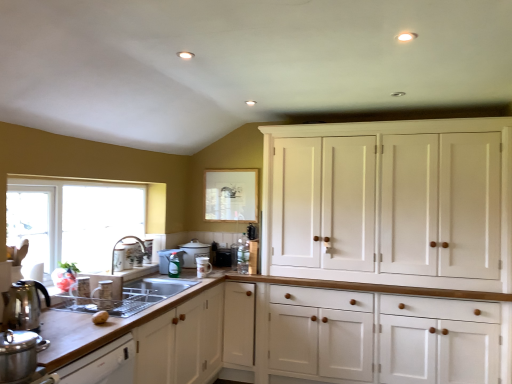
Question: Considering the relative sizes of brown matte potato at lower left and matte white cup at sink, which is counted as the second appliance, starting from the front, in the image provided, is brown matte potato at lower left taller than matte white cup at sink, which is counted as the second appliance, starting from the front,?

Choices:
 (A) no
 (B) yes

Answer: (A)

Question: Is brown matte potato at lower left facing away from matte white cup at sink, which is the 5th appliance in back-to-front order?

Choices:
 (A) no
 (B) yes

Answer: (A)

Question: Considering the relative sizes of brown matte potato at lower left and matte white cup at sink, which is the 5th appliance in back-to-front order, in the image provided, is brown matte potato at lower left smaller than matte white cup at sink, which is the 5th appliance in back-to-front order,?

Choices:
 (A) yes
 (B) no

Answer: (A)

Question: Is brown matte potato at lower left further to the viewer compared to matte white cup at sink, which is the 5th appliance in back-to-front order?

Choices:
 (A) no
 (B) yes

Answer: (A)

Question: Is brown matte potato at lower left not near matte white cup at sink, which is counted as the second appliance, starting from the front?

Choices:
 (A) no
 (B) yes

Answer: (A)

Question: From a real-world perspective, is black matte toaster at center, which ranks as the 1th appliance in back-to-front order, positioned above or below translucent plastic spray bottle at center, marked as the 3th appliance in a back-to-front arrangement?

Choices:
 (A) above
 (B) below

Answer: (B)

Question: From the image's perspective, relative to translucent plastic spray bottle at center, which is counted as the fourth appliance, starting from the front, is black matte toaster at center, which ranks as the sixth appliance in front-to-back order, above or below?

Choices:
 (A) below
 (B) above

Answer: (A)

Question: Would you say black matte toaster at center, which ranks as the 1th appliance in back-to-front order, is to the left or to the right of translucent plastic spray bottle at center, which is counted as the fourth appliance, starting from the front, in the picture?

Choices:
 (A) left
 (B) right

Answer: (B)

Question: Based on their sizes in the image, would you say black matte toaster at center, which ranks as the sixth appliance in front-to-back order, is bigger or smaller than translucent plastic spray bottle at center, which is counted as the fourth appliance, starting from the front?

Choices:
 (A) small
 (B) big

Answer: (A)

Question: Considering the positions of white ceramic mug at center, which is the third appliance from front to back, and shiny metallic kettle at left in the image, is white ceramic mug at center, which is the third appliance from front to back, wider or thinner than shiny metallic kettle at left?

Choices:
 (A) thin
 (B) wide

Answer: (A)

Question: Relative to shiny metallic kettle at left, is white ceramic mug at center, acting as the 4th appliance starting from the back, in front or behind?

Choices:
 (A) front
 (B) behind

Answer: (B)

Question: Considering the relative positions of white ceramic mug at center, acting as the 4th appliance starting from the back, and shiny metallic kettle at left in the image provided, is white ceramic mug at center, acting as the 4th appliance starting from the back, to the left or to the right of shiny metallic kettle at left?

Choices:
 (A) left
 (B) right

Answer: (B)

Question: From the image's perspective, is white ceramic mug at center, acting as the 4th appliance starting from the back, positioned above or below shiny metallic kettle at left?

Choices:
 (A) above
 (B) below

Answer: (B)

Question: From a real-world perspective, is white ceramic mug at center, which is the third appliance from front to back, above or below satin silver sink at lower left?

Choices:
 (A) above
 (B) below

Answer: (A)

Question: From the image's perspective, is white ceramic mug at center, which is the third appliance from front to back, positioned above or below satin silver sink at lower left?

Choices:
 (A) below
 (B) above

Answer: (B)